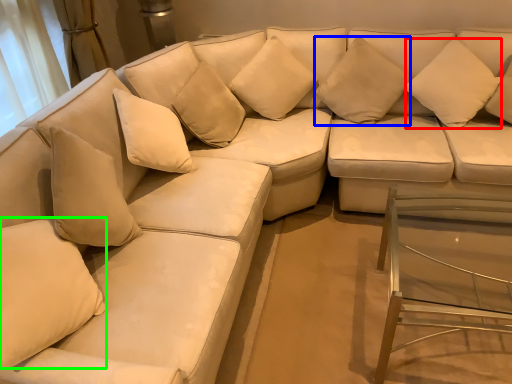
Question: Which object is the farthest from pillow (highlighted by a red box)? Choose among these: pillow (highlighted by a blue box) or pillow (highlighted by a green box).

Choices:
 (A) pillow
 (B) pillow

Answer: (B)